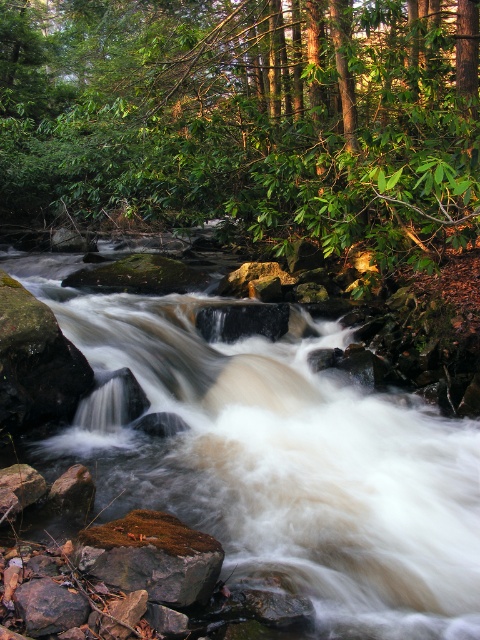
You are a hiker who wants to cross the stream safely. You see the green mossy rock at lower center and the brown rough rock at lower left. Which rock should you step on first to get closer to the other side?

You should step on the green mossy rock at lower center first because it is closer to you than the brown rough rock at lower left, allowing you to progress towards the other side more effectively.

You are a hiker who has just arrived at the forest stream. You want to cross the stream to reach the other side. You see the green leafy tree at center and the brown smooth rock at center. Which object is closer to you, and which one should you step on first?

The green leafy tree at center is closer to you than the brown smooth rock at center. However, to cross the stream safely, you should step on the brown smooth rock at center first since it is positioned in the stream and provides a stable footing, while the tree is on the bank.

You are a hiker carrying a backpack and need to cross the stream. You see a brown smooth rock at center and a brown rough rock at lower left. Which rock is closer to you if you are standing at the lower left bank?

The brown rough rock at lower left is closer to you since it is located at the lower left bank, while the brown smooth rock at center is 83.70 centimeters away from it.